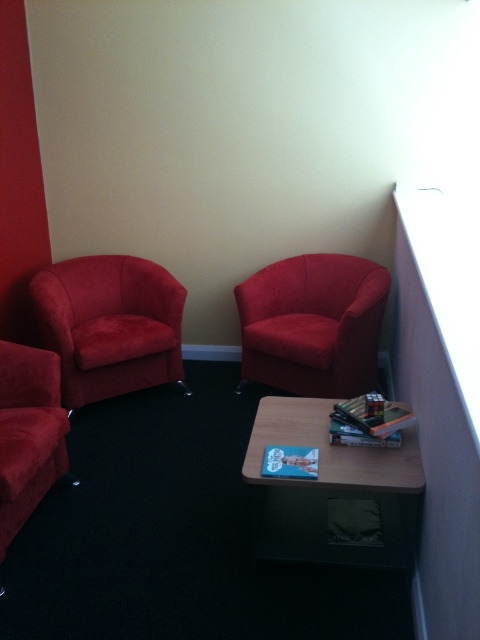
Is point (275, 522) more distant than point (37, 384)?

No, it is in front of (37, 384).

Which of these two, wooden side table at lower center or matte red couch at left, stands shorter?

With less height is wooden side table at lower center.

Is point (363, 472) behind point (24, 442)?

No.

This screenshot has width=480, height=640. I want to click on wooden side table at lower center, so point(330,490).

Is wooden side table at lower center positioned at the back of velvet red armchair at left?

No, it is in front of velvet red armchair at left.

Who is shorter, wooden side table at lower center or velvet red armchair at left?

Standing shorter between the two is wooden side table at lower center.

Which is in front, point (370, 484) or point (154, 276)?

Point (370, 484) is in front.

Where is `wooden side table at lower center`? This screenshot has width=480, height=640. wooden side table at lower center is located at coordinates (330, 490).

Which is below, velvet red armchair at upper right or velvet red armchair at left?

Positioned lower is velvet red armchair at left.

Who is more forward, (313,253) or (84,403)?

Point (84,403)

Find the location of `velvet red armchair at upper right`. velvet red armchair at upper right is located at coordinates (312, 324).